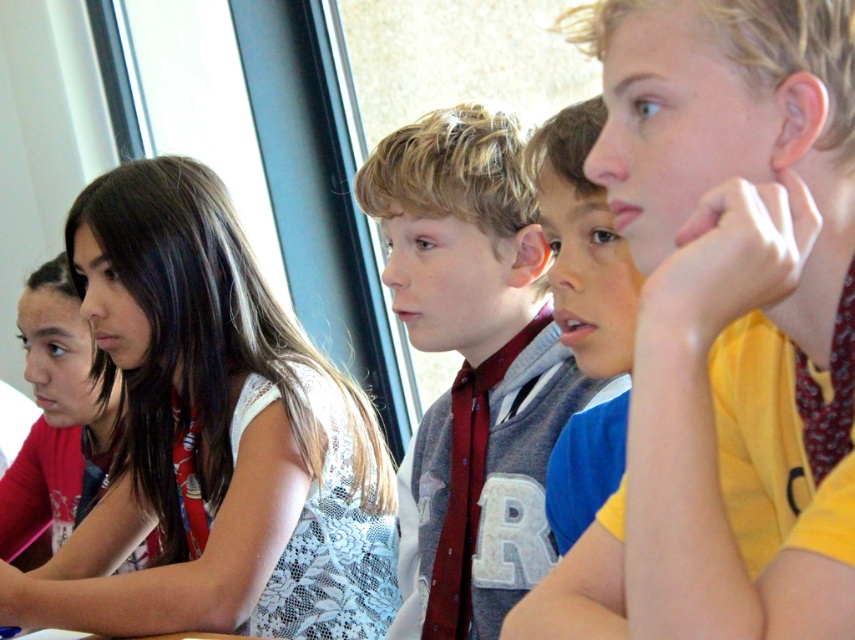
Question: From the image, what is the correct spatial relationship of blue fabric shirt at center in relation to matte red tie at center?

Choices:
 (A) left
 (B) right

Answer: (B)

Question: Where is white lace dress at upper left located in relation to pink fabric shirt at left in the image?

Choices:
 (A) right
 (B) left

Answer: (A)

Question: Among these points, which one is farthest from the camera?

Choices:
 (A) (479, 298)
 (B) (226, 257)

Answer: (B)

Question: Which point appears farthest from the camera in this image?

Choices:
 (A) (423, 413)
 (B) (770, 397)
 (C) (261, 333)

Answer: (C)

Question: Based on their relative distances, which object is nearer to the yellow cotton shirt at right?

Choices:
 (A) blue fabric shirt at center
 (B) pink fabric shirt at left
 (C) maroon tie at center

Answer: (A)

Question: Where is yellow cotton shirt at right located in relation to blue fabric shirt at center in the image?

Choices:
 (A) right
 (B) left

Answer: (A)